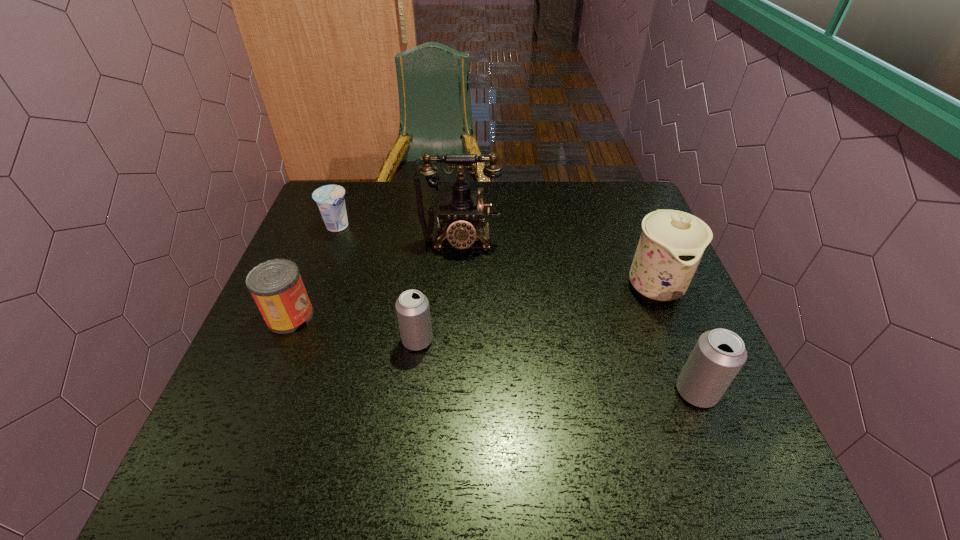
To make them evenly spaced by inserting another beer_can among them, please locate a free space for this new beer_can. Please provide its 2D coordinates. Your answer should be formatted as a tuple, i.e. [(x, y)], where the tuple contains the x and y coordinates of a point satisfying the conditions above.

[(550, 364)]